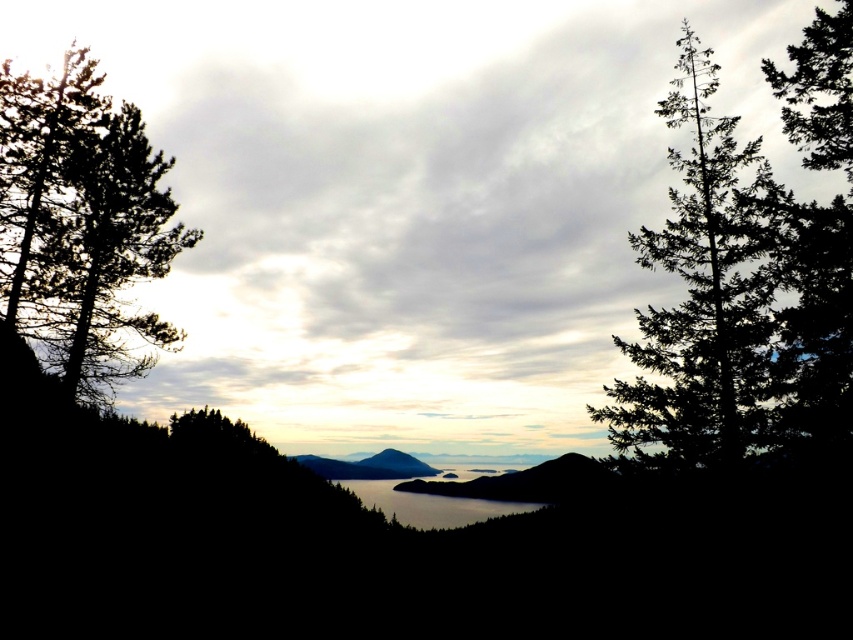
Which of these two, cloudy sky at center or green textured tree at right, stands shorter?

Standing shorter between the two is green textured tree at right.

Who is positioned more to the left, cloudy sky at center or green textured tree at right?

Positioned to the left is cloudy sky at center.

Is point (425, 272) less distant than point (824, 100)?

No, (425, 272) is behind (824, 100).

Find the location of a particular element. The width and height of the screenshot is (853, 640). cloudy sky at center is located at coordinates (410, 200).

Measure the distance from cloudy sky at center to green matte tree at left.

cloudy sky at center and green matte tree at left are 124.88 feet apart from each other.

Between point (672, 36) and point (16, 131), which one is positioned behind?

Point (672, 36)

You are a GUI agent. You are given a task and a screenshot of the screen. Output one action in this format:
    pyautogui.click(x=<x>, y=<y>)
    Task: Click on the cloudy sky at center
    This screenshot has height=640, width=853.
    Given the screenshot: What is the action you would take?
    pyautogui.click(x=410, y=200)

Who is lower down, green needle-like tree at right or clear water at center?

clear water at center is lower down.

Is point (656, 264) farther from camera compared to point (399, 499)?

No, it is in front of (399, 499).

Image resolution: width=853 pixels, height=640 pixels. Identify the location of green needle-like tree at right. (700, 294).